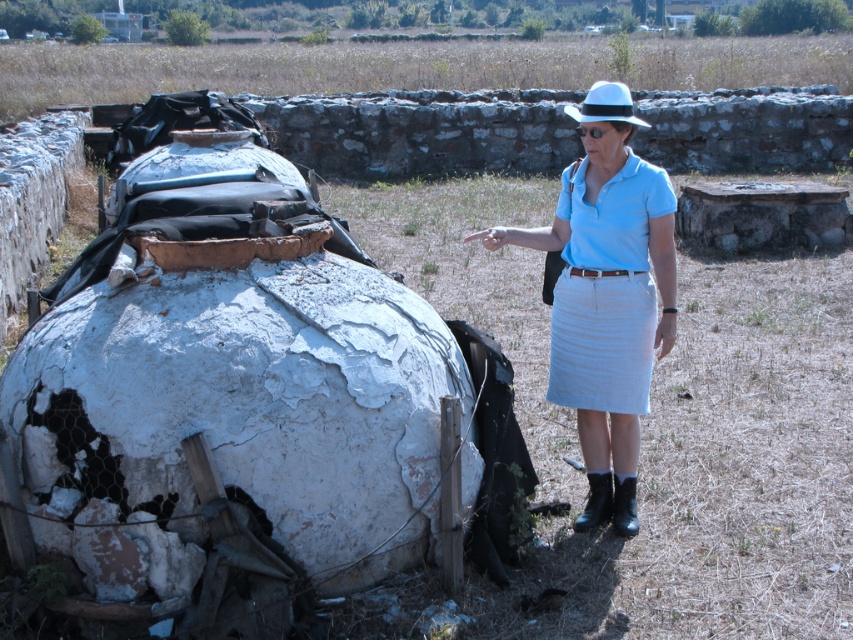
Question: Among these objects, which one is nearest to the camera?

Choices:
 (A) light blue cotton skirt at right
 (B) light blue cotton shirt at center
 (C) white felt hat at upper center

Answer: (C)

Question: Is light blue cotton shirt at center wider than white felt hat at upper center?

Choices:
 (A) yes
 (B) no

Answer: (B)

Question: Which point is closer to the camera taking this photo?

Choices:
 (A) (618, 88)
 (B) (663, 252)

Answer: (A)

Question: Is light blue cotton skirt at right positioned at the back of white felt hat at upper center?

Choices:
 (A) no
 (B) yes

Answer: (B)

Question: Does light blue cotton shirt at center appear on the left side of light blue cotton skirt at right?

Choices:
 (A) yes
 (B) no

Answer: (A)

Question: Estimate the real-world distances between objects in this image. Which object is farther from the light blue cotton skirt at right?

Choices:
 (A) white felt hat at upper center
 (B) light blue cotton shirt at center

Answer: (A)